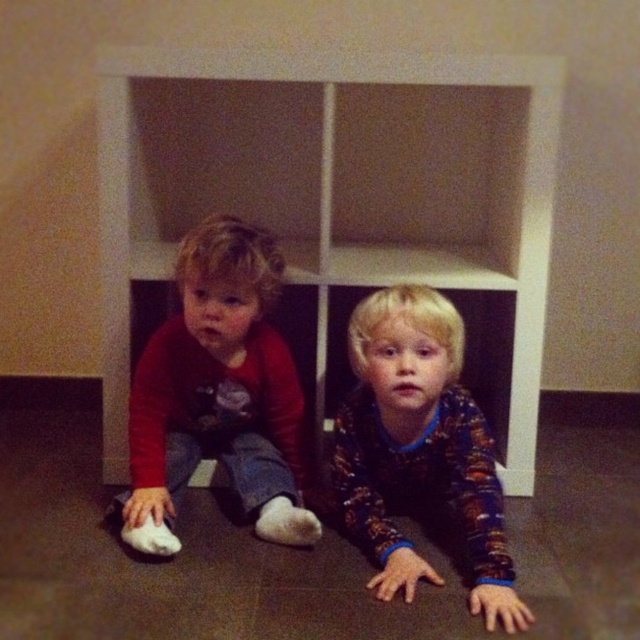
Question: Which of the following is the farthest from the observer?

Choices:
 (A) (236, 371)
 (B) (477, 566)

Answer: (A)

Question: Is matte red shirt at left positioned before flannel pajamas at lower center?

Choices:
 (A) no
 (B) yes

Answer: (A)

Question: Is matte red shirt at left further to camera compared to flannel pajamas at lower center?

Choices:
 (A) yes
 (B) no

Answer: (A)

Question: Can you confirm if matte red shirt at left is positioned below flannel pajamas at lower center?

Choices:
 (A) no
 (B) yes

Answer: (A)